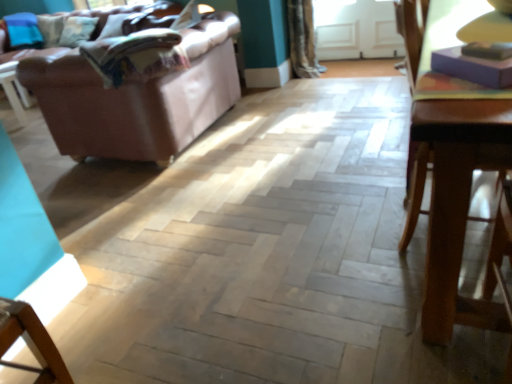
Question: Is textured beige curtain at upper center in front of wooden table at right?

Choices:
 (A) yes
 (B) no

Answer: (B)

Question: Are textured beige curtain at upper center and wooden table at right beside each other?

Choices:
 (A) no
 (B) yes

Answer: (A)

Question: Can you confirm if textured beige curtain at upper center is bigger than wooden table at right?

Choices:
 (A) yes
 (B) no

Answer: (B)

Question: Is textured beige curtain at upper center at the left side of wooden table at right?

Choices:
 (A) no
 (B) yes

Answer: (B)

Question: From the image's perspective, is textured beige curtain at upper center above wooden table at right?

Choices:
 (A) no
 (B) yes

Answer: (B)

Question: Is textured beige curtain at upper center turned away from wooden table at right?

Choices:
 (A) no
 (B) yes

Answer: (A)

Question: Is wooden table at right bigger than transparent glass door at upper center?

Choices:
 (A) no
 (B) yes

Answer: (B)

Question: From the image's perspective, would you say wooden table at right is shown under transparent glass door at upper center?

Choices:
 (A) no
 (B) yes

Answer: (B)

Question: Is wooden table at right positioned before transparent glass door at upper center?

Choices:
 (A) no
 (B) yes

Answer: (B)

Question: Can you confirm if wooden table at right is wider than transparent glass door at upper center?

Choices:
 (A) yes
 (B) no

Answer: (A)

Question: Does wooden table at right have a lesser height compared to transparent glass door at upper center?

Choices:
 (A) yes
 (B) no

Answer: (B)

Question: Is wooden table at right taller than transparent glass door at upper center?

Choices:
 (A) no
 (B) yes

Answer: (B)

Question: Does transparent glass door at upper center have a lesser width compared to textured beige curtain at upper center?

Choices:
 (A) yes
 (B) no

Answer: (A)